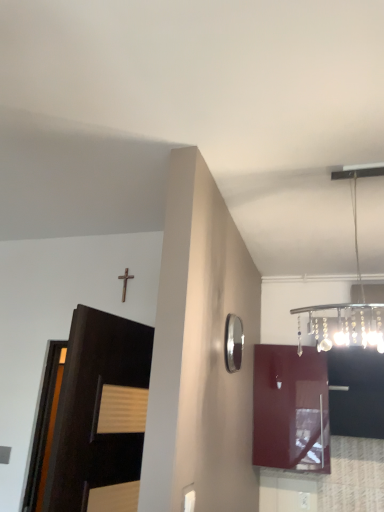
Question: From their relative heights in the image, would you say metallic chandelier at upper right is taller or shorter than black glossy cabinet at upper right, marked as the first cabinetry in a right-to-left arrangement?

Choices:
 (A) tall
 (B) short

Answer: (A)

Question: Is point (352, 210) closer or farther from the camera than point (382, 373)?

Choices:
 (A) closer
 (B) farther

Answer: (A)

Question: Estimate the real-world distances between objects in this image. Which object is farther from the metallic chandelier at upper right?

Choices:
 (A) black glossy cabinet at upper right, marked as the second cabinetry in a left-to-right arrangement
 (B) dark wood door at left
 (C) silver/metallic mirror at upper right
 (D) glossy burgundy cabinet at right, the first cabinetry positioned from the left

Answer: (B)

Question: Which object is positioned farthest from the metallic chandelier at upper right?

Choices:
 (A) black glossy cabinet at upper right, marked as the first cabinetry in a right-to-left arrangement
 (B) silver/metallic mirror at upper right
 (C) glossy burgundy cabinet at right, the first cabinetry positioned from the left
 (D) dark wood door at left

Answer: (D)